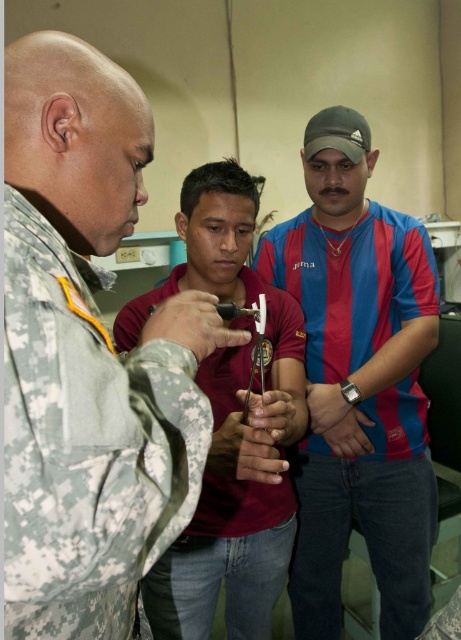
Locate an element on the screen. Image resolution: width=461 pixels, height=640 pixels. camouflage fabric uniform at left is located at coordinates (86, 444).

Is camouflage fabric uniform at left in front of camouflage fabric uniform at center?

That is True.

The width and height of the screenshot is (461, 640). What are the coordinates of `camouflage fabric uniform at left` in the screenshot? It's located at (86, 444).

Is blue striped shirt at center to the left of camouflage fabric uniform at center from the viewer's perspective?

No, blue striped shirt at center is not to the left of camouflage fabric uniform at center.

Is blue striped shirt at center bigger than camouflage fabric uniform at center?

Yes.

This screenshot has height=640, width=461. Find the location of `blue striped shirt at center`. blue striped shirt at center is located at coordinates (359, 381).

Is camouflage fabric uniform at left smaller than blue striped shirt at center?

Indeed, camouflage fabric uniform at left has a smaller size compared to blue striped shirt at center.

Is point (94, 326) farther from camera compared to point (429, 481)?

No.

The height and width of the screenshot is (640, 461). Find the location of `camouflage fabric uniform at left`. camouflage fabric uniform at left is located at coordinates (86, 444).